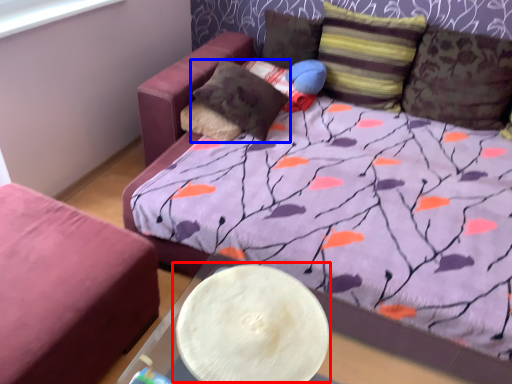
Question: Which object is closer to the camera taking this photo, round table (highlighted by a red box) or pillow (highlighted by a blue box)?

Choices:
 (A) round table
 (B) pillow

Answer: (A)